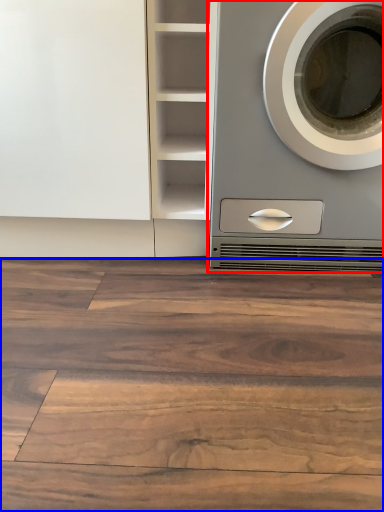
Question: Which of the following is the farthest to the observer, washing machine (highlighted by a red box) or hardwood (highlighted by a blue box)?

Choices:
 (A) washing machine
 (B) hardwood

Answer: (A)